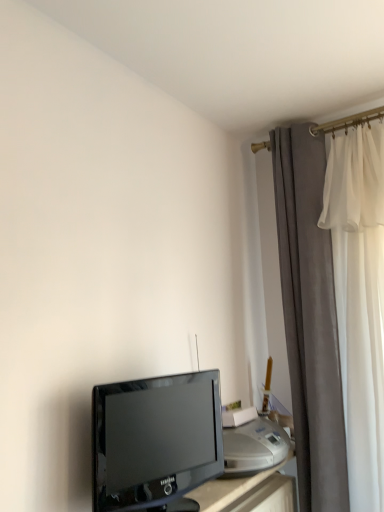
Question: In terms of height, does satin silver printer at lower right look taller or shorter compared to velvet gray curtain at right?

Choices:
 (A) short
 (B) tall

Answer: (A)

Question: Based on their sizes in the image, would you say satin silver printer at lower right is bigger or smaller than velvet gray curtain at right?

Choices:
 (A) small
 (B) big

Answer: (A)

Question: Estimate the real-world distances between objects in this image. Which object is farther from the satin silver printer at lower right?

Choices:
 (A) black glossy television at lower left
 (B) velvet gray curtain at right

Answer: (B)

Question: Based on their relative distances, which object is nearer to the velvet gray curtain at right?

Choices:
 (A) black glossy television at lower left
 (B) satin silver printer at lower right

Answer: (B)